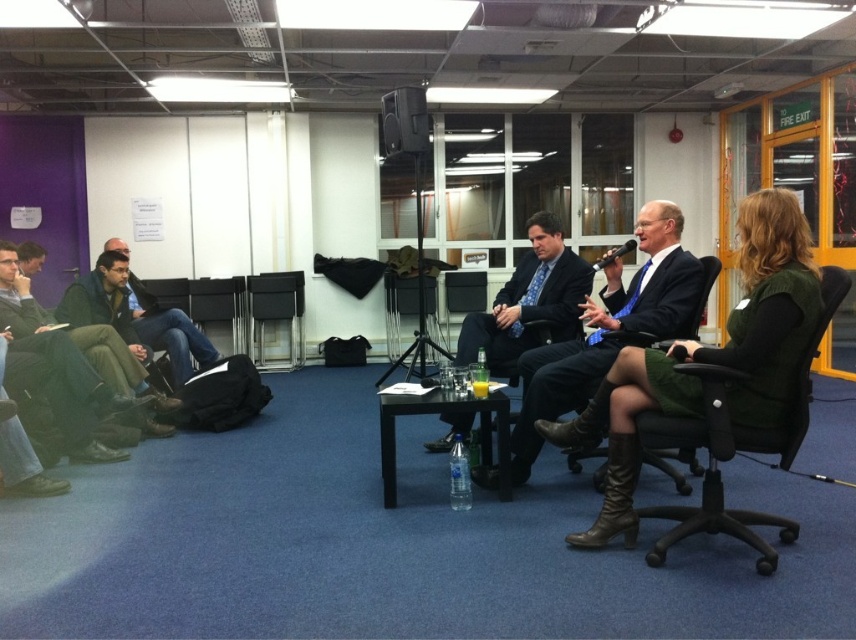
Who is shorter, green fabric skirt at center or dark green fabric chair at center?

dark green fabric chair at center is shorter.

Does point (740, 253) come behind point (715, 266)?

No, (740, 253) is closer to viewer.

What are the coordinates of `green fabric skirt at center` in the screenshot? It's located at (706, 358).

Is blue suit at center above black leather chair at center?

Actually, blue suit at center is below black leather chair at center.

Between blue suit at center and black leather chair at center, which one appears on the left side from the viewer's perspective?

Positioned to the left is black leather chair at center.

Does point (520, 369) come in front of point (242, 288)?

Yes, it is in front of point (242, 288).

This screenshot has width=856, height=640. I want to click on blue suit at center, so click(x=608, y=328).

Does blue suit at center lie behind green fabric swivel chair at center right?

Yes.

Does blue suit at center have a larger size compared to green fabric swivel chair at center right?

Correct, blue suit at center is larger in size than green fabric swivel chair at center right.

Is point (578, 342) more distant than point (745, 540)?

Yes, it is behind point (745, 540).

Locate an element on the screen. blue suit at center is located at coordinates (608, 328).